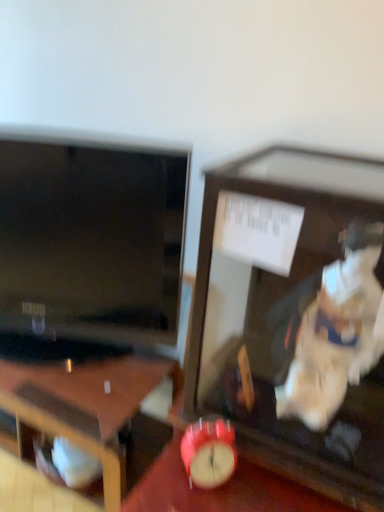
Question: In terms of width, does wooden desk at lower left look wider or thinner when compared to matte red alarm clock at center?

Choices:
 (A) wide
 (B) thin

Answer: (A)

Question: Is wooden desk at lower left inside the boundaries of matte red alarm clock at center, or outside?

Choices:
 (A) inside
 (B) outside

Answer: (B)

Question: Which is nearer to the wooden display case at center?

Choices:
 (A) wooden desk at lower left
 (B) matte red alarm clock at lower right
 (C) matte red alarm clock at center
 (D) matte black tv at left

Answer: (C)

Question: Which is farther from the wooden display case at center?

Choices:
 (A) matte red alarm clock at center
 (B) matte black tv at left
 (C) matte red alarm clock at lower right
 (D) wooden desk at lower left

Answer: (B)